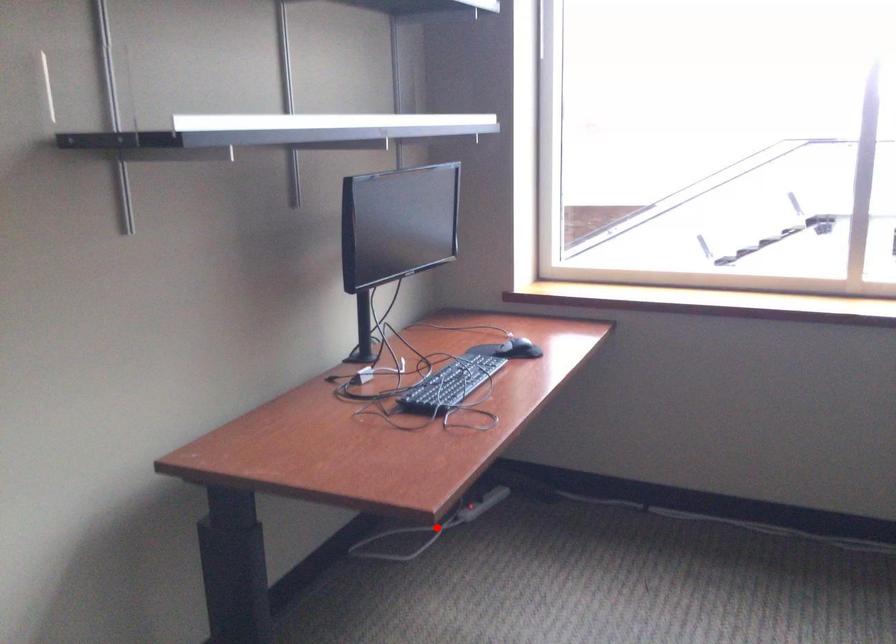
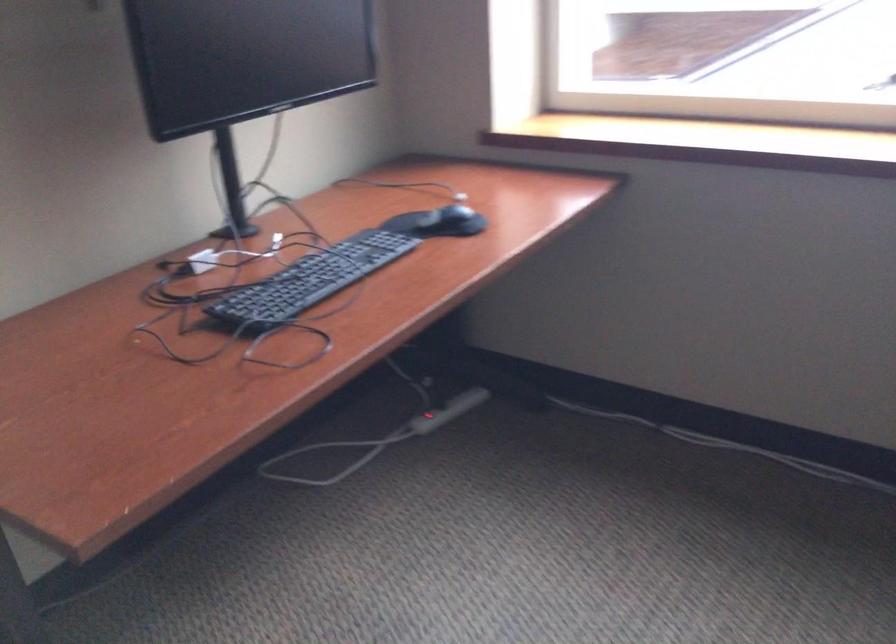
In the second image, find the point that corresponds to the highlighted location in the first image.

(378, 439)